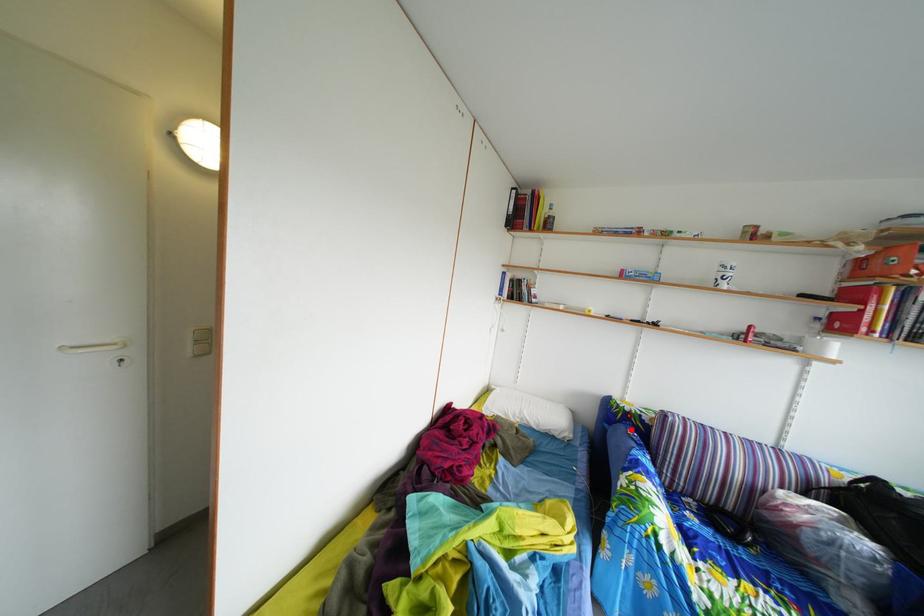
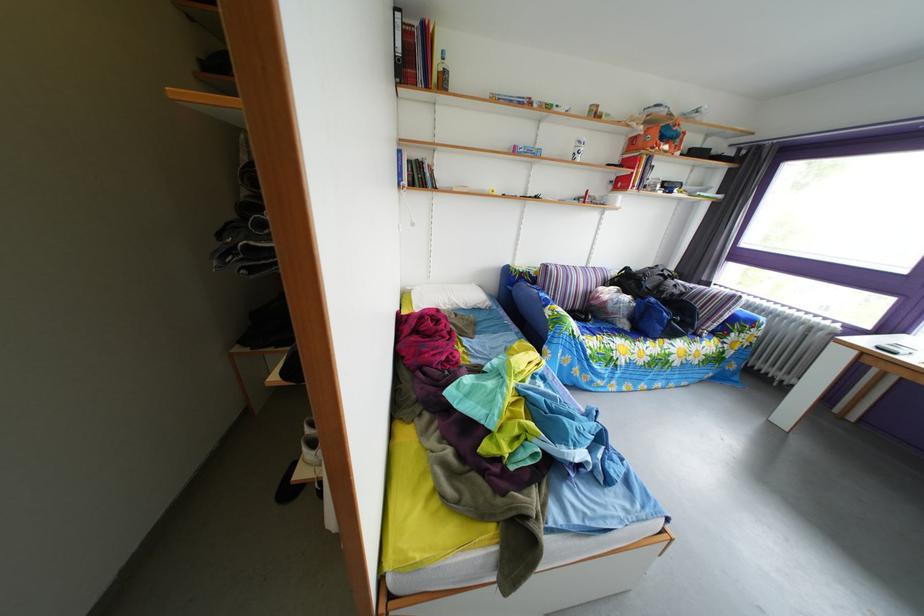
Question: I am providing you with two images of the same scene from different viewpoints. A red point is shown in image1. For the corresponding object point in image2, is it positioned nearer or farther from the camera?

Choices:
 (A) Nearer
 (B) Farther

Answer: (A)